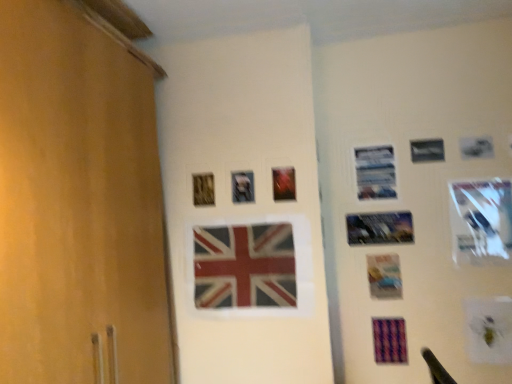
What is the approximate height of metallic silver picture frame at upper right, positioned as the fourth picture frame in left-to-right order?

30.34 centimeters.

How much space does metallic silver picture frame at upper right, the seventh picture frame in the left-to-right sequence, occupy vertically?

It is 16.78 inches.

Find the location of a particular element. metallic reflective photo frame at center-right, acting as the 5th picture frame starting from the left is located at coordinates (380, 228).

Describe the element at coordinates (203, 189) in the screenshot. I see `wooden picture frame at upper center, which ranks as the seventh picture frame in right-to-left order` at that location.

Locate an element on the screen. The height and width of the screenshot is (384, 512). metallic silver picture frame at upper right, which appears as the sixth picture frame when viewed from the left is located at coordinates (426, 150).

The height and width of the screenshot is (384, 512). I want to click on metallic silver picture frame at upper right, positioned as the fourth picture frame in left-to-right order, so pyautogui.click(x=375, y=172).

Can you confirm if metallic reflective photo frame at center-right, which ranks as the third picture frame in right-to-left order, is taller than metallic silver picture frame at upper right, which appears as the sixth picture frame when viewed from the left?

Indeed, metallic reflective photo frame at center-right, which ranks as the third picture frame in right-to-left order, has a greater height compared to metallic silver picture frame at upper right, which appears as the sixth picture frame when viewed from the left.

Is there a large distance between metallic reflective photo frame at center-right, acting as the 5th picture frame starting from the left, and metallic silver picture frame at upper right, which is counted as the 2th picture frame, starting from the right?

No.

Which object is closer to the camera, metallic reflective photo frame at center-right, acting as the 5th picture frame starting from the left, or metallic silver picture frame at upper right, which is counted as the 2th picture frame, starting from the right?

metallic silver picture frame at upper right, which is counted as the 2th picture frame, starting from the right, is in front.

From the image's perspective, relative to metallic reflective photo frame at center-right, which ranks as the third picture frame in right-to-left order, is metallic silver picture frame at upper right, marked as the 4th picture frame in a right-to-left arrangement, above or below?

Based on their image positions, metallic silver picture frame at upper right, marked as the 4th picture frame in a right-to-left arrangement, is located above metallic reflective photo frame at center-right, which ranks as the third picture frame in right-to-left order.

From a real-world perspective, between metallic silver picture frame at upper right, marked as the 4th picture frame in a right-to-left arrangement, and metallic reflective photo frame at center-right, which ranks as the third picture frame in right-to-left order, who is vertically higher?

metallic silver picture frame at upper right, marked as the 4th picture frame in a right-to-left arrangement.

In the image, is metallic silver picture frame at upper right, marked as the 4th picture frame in a right-to-left arrangement, positioned in front of or behind metallic reflective photo frame at center-right, acting as the 5th picture frame starting from the left?

metallic silver picture frame at upper right, marked as the 4th picture frame in a right-to-left arrangement, is behind metallic reflective photo frame at center-right, acting as the 5th picture frame starting from the left.

Can you tell me how much metallic reflective photo frame at center-right, acting as the 5th picture frame starting from the left, and metallic reflective photo frame at upper center, arranged as the fifth picture frame when viewed from the right, differ in facing direction?

There is a 0.828-degree angle between the facing directions of metallic reflective photo frame at center-right, acting as the 5th picture frame starting from the left, and metallic reflective photo frame at upper center, arranged as the fifth picture frame when viewed from the right.

Are metallic reflective photo frame at center-right, which ranks as the third picture frame in right-to-left order, and metallic reflective photo frame at upper center, the third picture frame when ordered from left to right, far apart?

No, metallic reflective photo frame at center-right, which ranks as the third picture frame in right-to-left order, is not far from metallic reflective photo frame at upper center, the third picture frame when ordered from left to right.

Does point (359, 221) appear closer or farther from the camera than point (292, 187)?

Point (359, 221) is farther from the camera than point (292, 187).

Is metallic reflective photo frame at upper center, the third picture frame when ordered from left to right, at the back of metallic reflective photo frame at center-right, acting as the 5th picture frame starting from the left?

No, metallic reflective photo frame at upper center, the third picture frame when ordered from left to right, is not at the back of metallic reflective photo frame at center-right, acting as the 5th picture frame starting from the left.

Considering the relative sizes of purple striped postcard at lower right and metallic silver picture frame at center, placed as the 2th picture frame when sorted from left to right, in the image provided, is purple striped postcard at lower right taller than metallic silver picture frame at center, placed as the 2th picture frame when sorted from left to right,?

Indeed, purple striped postcard at lower right has a greater height compared to metallic silver picture frame at center, placed as the 2th picture frame when sorted from left to right.

Would you consider purple striped postcard at lower right to be distant from metallic silver picture frame at center, positioned as the sixth picture frame in right-to-left order?

No, there isn't a large distance between purple striped postcard at lower right and metallic silver picture frame at center, positioned as the sixth picture frame in right-to-left order.

How distant is metallic reflective photo frame at upper center, arranged as the fifth picture frame when viewed from the right, from purple striped postcard at lower right?

metallic reflective photo frame at upper center, arranged as the fifth picture frame when viewed from the right, is 80.44 centimeters from purple striped postcard at lower right.

Does metallic reflective photo frame at upper center, arranged as the fifth picture frame when viewed from the right, turn towards purple striped postcard at lower right?

No, metallic reflective photo frame at upper center, arranged as the fifth picture frame when viewed from the right, is not facing towards purple striped postcard at lower right.

What's the angular difference between metallic reflective photo frame at upper center, the third picture frame when ordered from left to right, and purple striped postcard at lower right's facing directions?

The angle between the facing direction of metallic reflective photo frame at upper center, the third picture frame when ordered from left to right, and the facing direction of purple striped postcard at lower right is 0.828 degrees.

Which object is further away from the camera taking this photo, metallic reflective photo frame at upper center, the third picture frame when ordered from left to right, or purple striped postcard at lower right?

purple striped postcard at lower right is behind.

You are a GUI agent. You are given a task and a screenshot of the screen. Output one action in this format:
    pyautogui.click(x=<x>, y=<y>)
    Task: Click on the 2nd picture frame directly beneath the wooden picture frame at upper center, positioned as the 1th picture frame in left-to-right order (from a real-world perspective)
    Image resolution: width=512 pixels, height=384 pixels.
    Given the screenshot: What is the action you would take?
    pyautogui.click(x=284, y=184)

Is wooden picture frame at upper center, positioned as the 1th picture frame in left-to-right order, shorter than metallic reflective photo frame at upper center, the third picture frame when ordered from left to right?

Correct, wooden picture frame at upper center, positioned as the 1th picture frame in left-to-right order, is not as tall as metallic reflective photo frame at upper center, the third picture frame when ordered from left to right.

Is wooden picture frame at upper center, which ranks as the seventh picture frame in right-to-left order, situated inside metallic reflective photo frame at upper center, the third picture frame when ordered from left to right, or outside?

The correct answer is: outside.

Visually, is wooden picture frame at upper center, positioned as the 1th picture frame in left-to-right order, positioned to the left or to the right of metallic reflective photo frame at upper center, arranged as the fifth picture frame when viewed from the right?

Based on their positions, wooden picture frame at upper center, positioned as the 1th picture frame in left-to-right order, is located to the left of metallic reflective photo frame at upper center, arranged as the fifth picture frame when viewed from the right.

Is matte plastic flag at center completely or partially outside of metallic reflective photo frame at upper center, the third picture frame when ordered from left to right?

That's correct, matte plastic flag at center is outside of metallic reflective photo frame at upper center, the third picture frame when ordered from left to right.

In the image, is matte plastic flag at center positioned in front of or behind metallic reflective photo frame at upper center, the third picture frame when ordered from left to right?

matte plastic flag at center is in front of metallic reflective photo frame at upper center, the third picture frame when ordered from left to right.

Are matte plastic flag at center and metallic reflective photo frame at upper center, the third picture frame when ordered from left to right, located far from each other?

No, matte plastic flag at center is in close proximity to metallic reflective photo frame at upper center, the third picture frame when ordered from left to right.

Considering the relative sizes of matte plastic flag at center and metallic reflective photo frame at upper center, arranged as the fifth picture frame when viewed from the right, in the image provided, is matte plastic flag at center smaller than metallic reflective photo frame at upper center, arranged as the fifth picture frame when viewed from the right,?

No.

The image size is (512, 384). Find the location of `picture frame that is the 5th object directly below the metallic silver picture frame at upper right, which appears as the sixth picture frame when viewed from the left (from a real-world perspective)`. picture frame that is the 5th object directly below the metallic silver picture frame at upper right, which appears as the sixth picture frame when viewed from the left (from a real-world perspective) is located at coordinates (380, 228).

Where is `the 1st picture frame to the left of the metallic reflective photo frame at center-right, which ranks as the third picture frame in right-to-left order, starting your count from the anchor`? The image size is (512, 384). the 1st picture frame to the left of the metallic reflective photo frame at center-right, which ranks as the third picture frame in right-to-left order, starting your count from the anchor is located at coordinates (375, 172).

From the image, which object appears to be farther from wooden picture frame at upper center, positioned as the 1th picture frame in left-to-right order, matte plastic flag at center or metallic silver picture frame at upper right, which is the first picture frame from right to left?

metallic silver picture frame at upper right, which is the first picture frame from right to left, is further to wooden picture frame at upper center, positioned as the 1th picture frame in left-to-right order.

Which object lies further to the anchor point metallic silver picture frame at upper right, marked as the 4th picture frame in a right-to-left arrangement, metallic reflective photo frame at center-right, acting as the 5th picture frame starting from the left, or metallic silver picture frame at upper right, which appears as the sixth picture frame when viewed from the left?

metallic silver picture frame at upper right, which appears as the sixth picture frame when viewed from the left.

Which object lies nearer to the anchor point metallic silver picture frame at upper right, the seventh picture frame in the left-to-right sequence, metallic reflective photo frame at upper center, the third picture frame when ordered from left to right, or metallic silver picture frame at upper right, which appears as the sixth picture frame when viewed from the left?

metallic silver picture frame at upper right, which appears as the sixth picture frame when viewed from the left, is closer to metallic silver picture frame at upper right, the seventh picture frame in the left-to-right sequence.

Considering their positions, is metallic silver picture frame at upper right, marked as the 4th picture frame in a right-to-left arrangement, positioned closer to metallic silver picture frame at upper right, the seventh picture frame in the left-to-right sequence, than wooden picture frame at upper center, which ranks as the seventh picture frame in right-to-left order?

metallic silver picture frame at upper right, marked as the 4th picture frame in a right-to-left arrangement.

Looking at the image, which one is located closer to metallic silver picture frame at center, positioned as the sixth picture frame in right-to-left order, metallic silver picture frame at upper right, which is the first picture frame from right to left, or metallic silver picture frame at upper right, marked as the 4th picture frame in a right-to-left arrangement?

metallic silver picture frame at upper right, marked as the 4th picture frame in a right-to-left arrangement.

Considering their positions, is matte plastic flag at center positioned closer to metallic silver picture frame at upper right, which is the first picture frame from right to left, than metallic silver picture frame at center, placed as the 2th picture frame when sorted from left to right?

Based on the image, matte plastic flag at center appears to be nearer to metallic silver picture frame at upper right, which is the first picture frame from right to left.

Based on their spatial positions, is metallic reflective photo frame at center-right, which ranks as the third picture frame in right-to-left order, or purple striped postcard at lower right closer to metallic silver picture frame at upper right, positioned as the fourth picture frame in left-to-right order?

metallic reflective photo frame at center-right, which ranks as the third picture frame in right-to-left order, lies closer to metallic silver picture frame at upper right, positioned as the fourth picture frame in left-to-right order, than the other object.

Looking at the image, which one is located closer to metallic silver picture frame at center, placed as the 2th picture frame when sorted from left to right, metallic reflective photo frame at upper center, the third picture frame when ordered from left to right, or metallic silver picture frame at upper right, marked as the 4th picture frame in a right-to-left arrangement?

Among the two, metallic reflective photo frame at upper center, the third picture frame when ordered from left to right, is located nearer to metallic silver picture frame at center, placed as the 2th picture frame when sorted from left to right.

Where is `flag between metallic reflective photo frame at upper center, arranged as the fifth picture frame when viewed from the right, and purple striped postcard at lower right in the up-down direction`? This screenshot has height=384, width=512. flag between metallic reflective photo frame at upper center, arranged as the fifth picture frame when viewed from the right, and purple striped postcard at lower right in the up-down direction is located at coordinates (245, 266).

Locate an element on the screen. The image size is (512, 384). flag situated between wooden picture frame at upper center, positioned as the 1th picture frame in left-to-right order, and metallic reflective photo frame at center-right, acting as the 5th picture frame starting from the left, from left to right is located at coordinates (245, 266).

At what (x,y) coordinates should I click in order to perform the action: click on flag between metallic silver picture frame at upper right, marked as the 4th picture frame in a right-to-left arrangement, and purple striped postcard at lower right vertically. Please return your answer as a coordinate pair (x, y). Looking at the image, I should click on (245, 266).

This screenshot has width=512, height=384. In order to click on postcard situated between wooden picture frame at upper center, which ranks as the seventh picture frame in right-to-left order, and metallic silver picture frame at upper right, which appears as the sixth picture frame when viewed from the left, from left to right in this screenshot , I will do `click(389, 340)`.